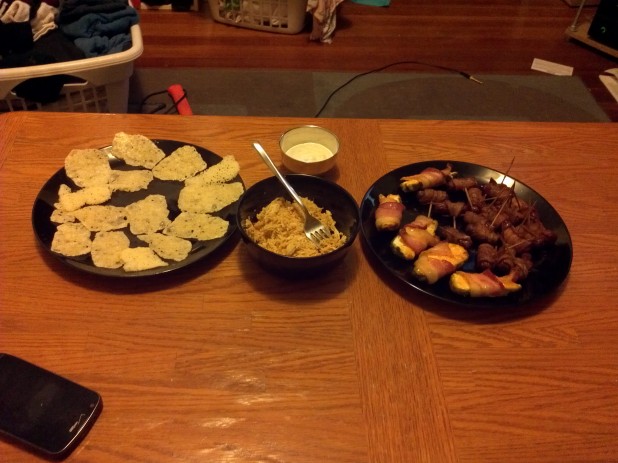
Locate an element on the screen. bowls is located at coordinates (329, 188), (315, 135).